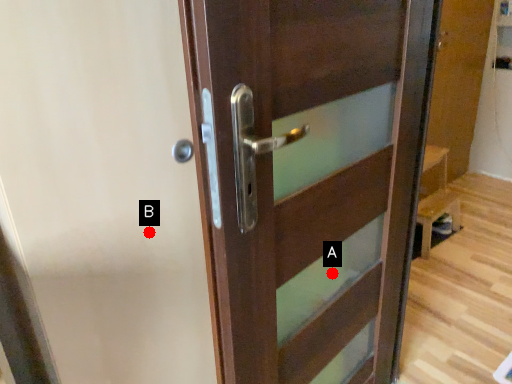
Question: Two points are circled on the image, labeled by A and B beside each circle. Which point appears farthest from the camera in this image?

Choices:
 (A) A is further
 (B) B is further

Answer: (A)